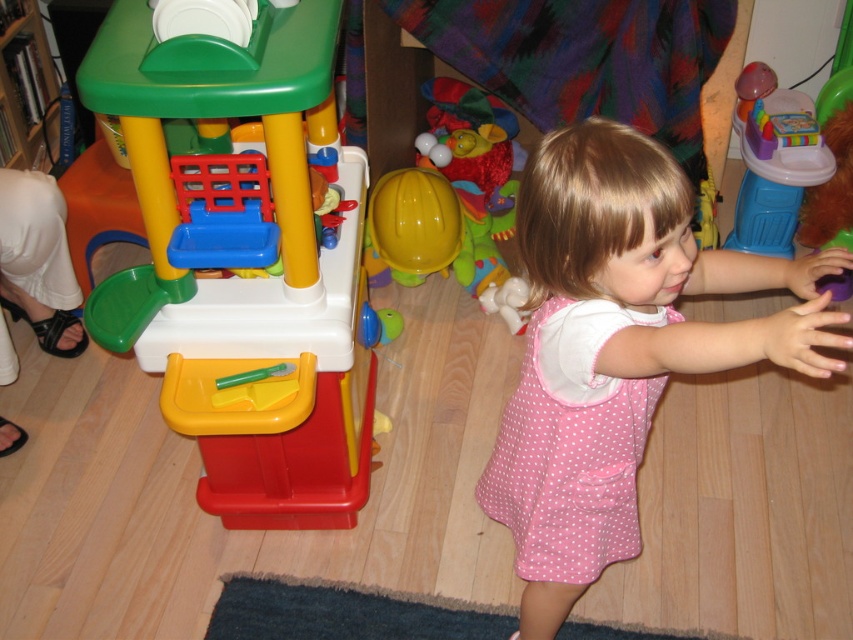
You are a parent trying to find your child in a playroom. You see the pink dotted dress at center and the pink polka dot dress at center. Which one is lower?

The pink dotted dress at center is located below the pink polka dot dress at center, so the pink dotted dress at center is lower.

Looking at this image, you are a parent looking at the image of your child in the playroom. You see the pink dotted dress at center and the pink polka dot dress at center. Which dress is more to the right?

→ The pink dotted dress at center is more to the right because it is positioned on the right side of the pink polka dot dress at center.

You are a parent trying to organize the playroom. You need to place a new toy box that is 2 feet wide between the plastic play kitchen at left and the yellow plastic hard hat at center. Can you fit it there?

The plastic play kitchen at left might be wider than the yellow plastic hard hat at center, so the space between them may not be sufficient to fit a 2 feet wide toy box. Check the exact width of the kitchen first.